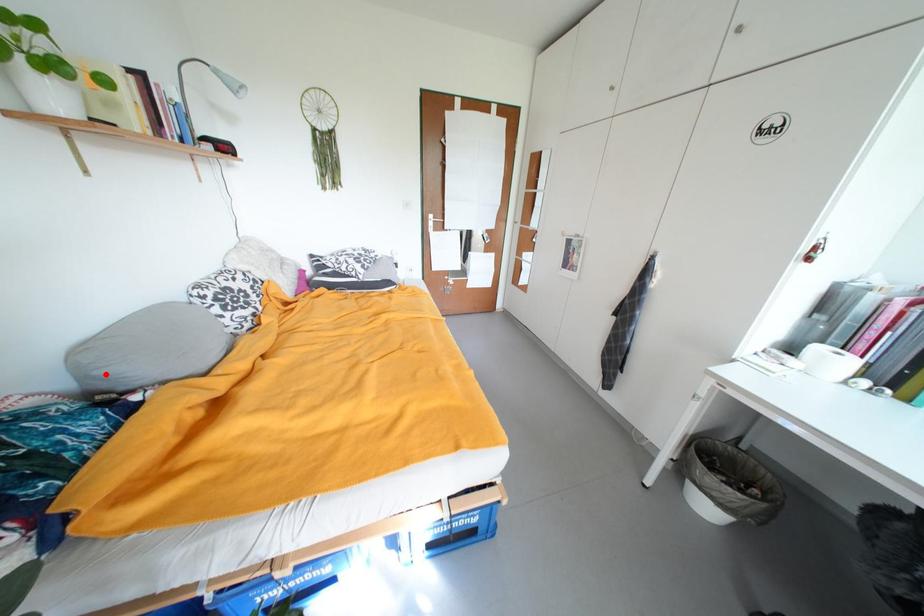
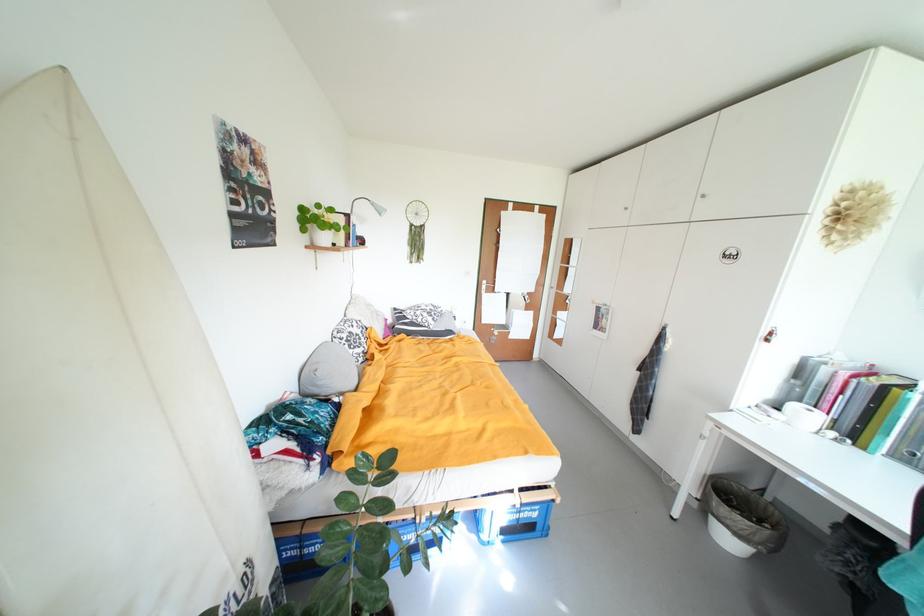
Question: I am providing you with two images of the same scene from different viewpoints. A red point is shown in image1. For the corresponding object point in image2, is it positioned nearer or farther from the camera?

Choices:
 (A) Nearer
 (B) Farther

Answer: (A)